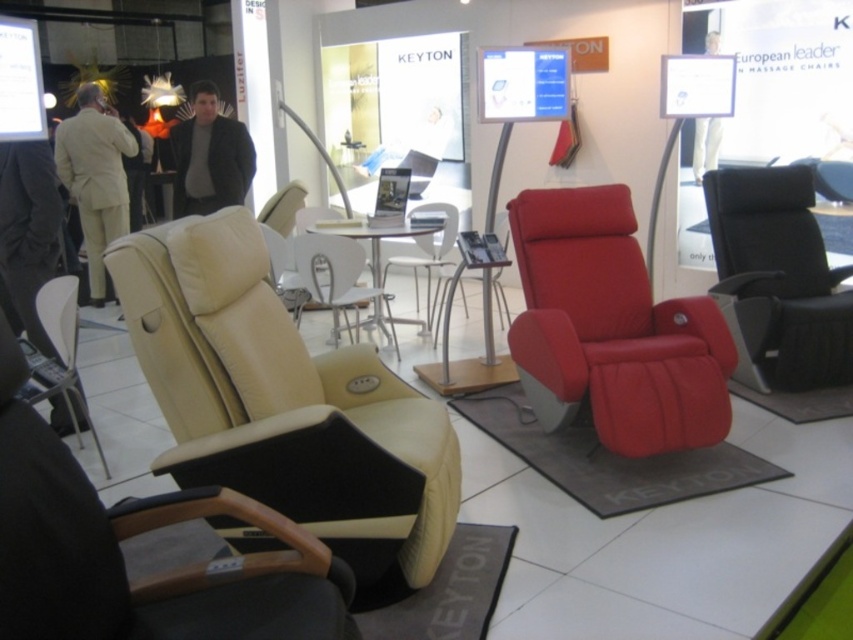
Question: Which point is farther from the camera taking this photo?

Choices:
 (A) (451, 237)
 (B) (680, 358)
 (C) (329, 273)

Answer: (A)

Question: Does beige leather armchair at left have a smaller size compared to matte white chair at center?

Choices:
 (A) yes
 (B) no

Answer: (B)

Question: Can you confirm if beige leather chair at lower left is bigger than beige leather chair at center?

Choices:
 (A) yes
 (B) no

Answer: (B)

Question: Among these objects, which one is farthest from the camera?

Choices:
 (A) matte red swivel chair at center
 (B) beige leather chair at center
 (C) beige leather armchair at left

Answer: (B)

Question: Based on their relative distances, which object is nearer to the beige leather chair at lower left?

Choices:
 (A) beige leather chair at center
 (B) matte black armchair at right
 (C) matte white chair at center
 (D) beige leather armchair at left

Answer: (D)

Question: From the image, what is the correct spatial relationship of beige leather chair at lower left in relation to beige leather chair at center?

Choices:
 (A) right
 (B) left

Answer: (B)